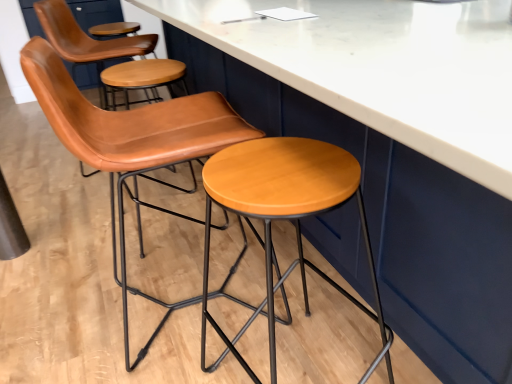
Question: Considering the relative sizes of leather at center and wooden/matte stool at center in the image provided, is leather at center taller than wooden/matte stool at center?

Choices:
 (A) no
 (B) yes

Answer: (B)

Question: Is leather at center aimed at wooden/matte stool at center?

Choices:
 (A) yes
 (B) no

Answer: (B)

Question: Considering the relative positions of leather at center and wooden/matte stool at center in the image provided, is leather at center to the right of wooden/matte stool at center from the viewer's perspective?

Choices:
 (A) no
 (B) yes

Answer: (A)

Question: Is leather at center far from wooden/matte stool at center?

Choices:
 (A) no
 (B) yes

Answer: (A)

Question: Is leather at center facing away from wooden/matte stool at center?

Choices:
 (A) yes
 (B) no

Answer: (B)

Question: Can you confirm if leather at center is bigger than wooden/matte stool at center?

Choices:
 (A) yes
 (B) no

Answer: (A)

Question: Can you confirm if wooden/matte stool at center is wider than leather at center?

Choices:
 (A) yes
 (B) no

Answer: (B)

Question: Does wooden/matte stool at center have a greater height compared to leather at center?

Choices:
 (A) no
 (B) yes

Answer: (A)

Question: Is wooden/matte stool at center at the left side of leather at center?

Choices:
 (A) yes
 (B) no

Answer: (B)

Question: Is wooden/matte stool at center smaller than leather at center?

Choices:
 (A) no
 (B) yes

Answer: (B)

Question: Is wooden/matte stool at center not near leather at center?

Choices:
 (A) no
 (B) yes

Answer: (A)

Question: From a real-world perspective, is wooden/matte stool at center physically above leather at center?

Choices:
 (A) yes
 (B) no

Answer: (B)

Question: Is wooden/matte stool at center taller or shorter than leather at center?

Choices:
 (A) tall
 (B) short

Answer: (B)